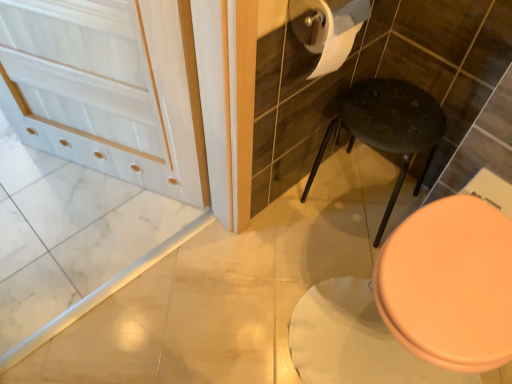
You are a GUI agent. You are given a task and a screenshot of the screen. Output one action in this format:
    pyautogui.click(x=<x>, y=<y>)
    Task: Click on the free space to the left of pink glossy toilet seat at lower right
    
    Given the screenshot: What is the action you would take?
    pyautogui.click(x=261, y=282)